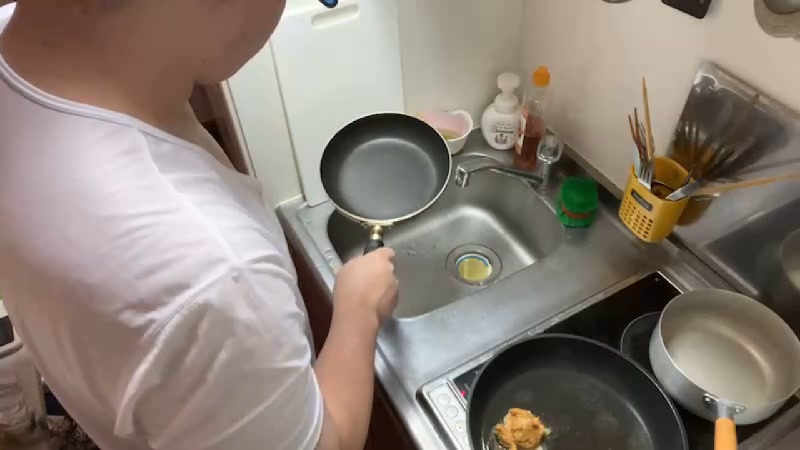
You are a GUI agent. You are given a task and a screenshot of the screen. Output one action in this format:
    pyautogui.click(x=<x>, y=<y>)
    Task: Click on the cut board
    Image resolution: width=800 pixels, height=450 pixels.
    Given the screenshot: What is the action you would take?
    pyautogui.click(x=330, y=94)